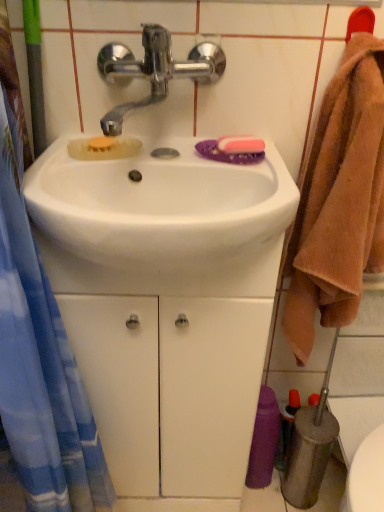
The height and width of the screenshot is (512, 384). In order to click on free spot above white glossy cabinet at center (from a real-world perspective) in this screenshot , I will do `click(157, 196)`.